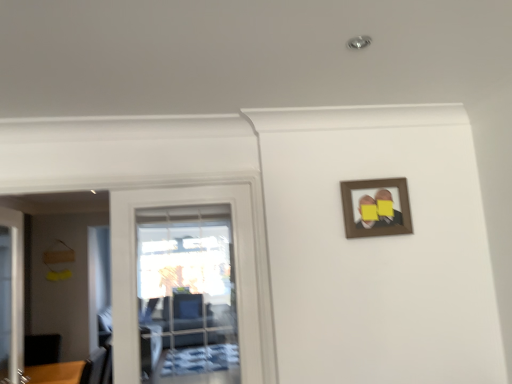
Question: Considering the relative sizes of brown wooden picture frame at upper right and white glossy door at left, which is the second door from right to left, in the image provided, is brown wooden picture frame at upper right shorter than white glossy door at left, which is the second door from right to left,?

Choices:
 (A) yes
 (B) no

Answer: (A)

Question: Is white glossy door at left, which is the second door from right to left, located within brown wooden picture frame at upper right?

Choices:
 (A) yes
 (B) no

Answer: (B)

Question: Can you confirm if brown wooden picture frame at upper right is positioned to the left of white glossy door at left, which is the second door from right to left?

Choices:
 (A) no
 (B) yes

Answer: (A)

Question: Can you confirm if brown wooden picture frame at upper right is wider than white glossy door at left, which ranks as the first door in left-to-right order?

Choices:
 (A) yes
 (B) no

Answer: (B)

Question: Is brown wooden picture frame at upper right positioned beyond the bounds of white glossy door at left, which is the second door from right to left?

Choices:
 (A) no
 (B) yes

Answer: (B)

Question: From a real-world perspective, is transparent glass door at left, which is counted as the 2th door, starting from the left, physically located above or below white glossy door at left, which is the second door from right to left?

Choices:
 (A) below
 (B) above

Answer: (B)

Question: In terms of width, does transparent glass door at left, which is counted as the 2th door, starting from the left, look wider or thinner when compared to white glossy door at left, which ranks as the first door in left-to-right order?

Choices:
 (A) thin
 (B) wide

Answer: (A)

Question: From their relative heights in the image, would you say transparent glass door at left, which appears as the first door when viewed from the right, is taller or shorter than white glossy door at left, which ranks as the first door in left-to-right order?

Choices:
 (A) short
 (B) tall

Answer: (A)

Question: Do you think transparent glass door at left, which appears as the first door when viewed from the right, is within white glossy door at left, which ranks as the first door in left-to-right order, or outside of it?

Choices:
 (A) inside
 (B) outside

Answer: (B)

Question: In the image, is white glossy door at left, which ranks as the first door in left-to-right order, positioned in front of or behind transparent glass door at left, which is counted as the 2th door, starting from the left?

Choices:
 (A) front
 (B) behind

Answer: (B)

Question: Looking at their shapes, would you say white glossy door at left, which ranks as the first door in left-to-right order, is wider or thinner than transparent glass door at left, which appears as the first door when viewed from the right?

Choices:
 (A) wide
 (B) thin

Answer: (A)

Question: From the image's perspective, is white glossy door at left, which ranks as the first door in left-to-right order, located above or below transparent glass door at left, which is counted as the 2th door, starting from the left?

Choices:
 (A) below
 (B) above

Answer: (A)

Question: Considering the positions of point (x=22, y=226) and point (x=128, y=297), is point (x=22, y=226) closer or farther from the camera than point (x=128, y=297)?

Choices:
 (A) farther
 (B) closer

Answer: (A)

Question: Looking at the image, does brown wooden picture frame at upper right seem bigger or smaller compared to transparent glass door at left, which appears as the first door when viewed from the right?

Choices:
 (A) small
 (B) big

Answer: (A)

Question: Considering their positions, is brown wooden picture frame at upper right located in front of or behind transparent glass door at left, which appears as the first door when viewed from the right?

Choices:
 (A) front
 (B) behind

Answer: (B)